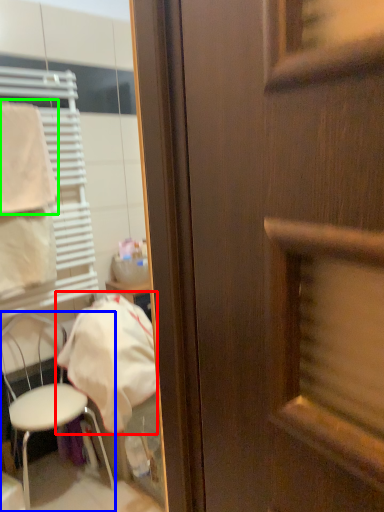
Question: Which is farther away from cloth (highlighted by a red box)? chair (highlighted by a blue box) or towel/napkin (highlighted by a green box)?

Choices:
 (A) chair
 (B) towel/napkin

Answer: (B)